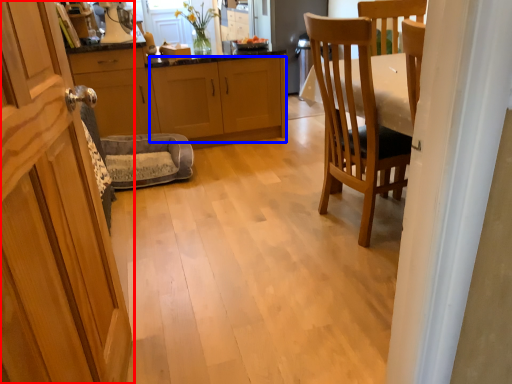
Question: Which of the following is the closest to the observer, cabinetry (highlighted by a red box) or cabinetry (highlighted by a blue box)?

Choices:
 (A) cabinetry
 (B) cabinetry

Answer: (A)